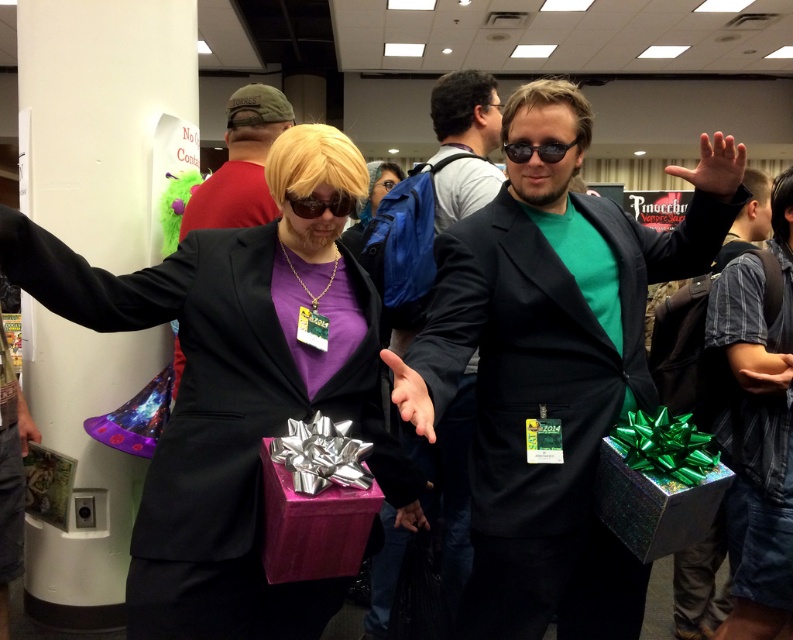
In the scene shown: Is matte purple gift box at center further to camera compared to green matte hand at upper right?

No, it is not.

Does matte purple gift box at center have a greater height compared to green matte hand at upper right?

Yes.

Is point (267, 362) positioned before point (711, 138)?

That is True.

Identify the location of matte purple gift box at center. Image resolution: width=793 pixels, height=640 pixels. (236, 392).

Is green matte hand at upper right thinner than matte black hand at center?

Incorrect, green matte hand at upper right's width is not less than matte black hand at center's.

Does point (700, 150) come farther from viewer compared to point (396, 358)?

Yes, it is behind point (396, 358).

Find the location of a particular element. green matte hand at upper right is located at coordinates (714, 164).

From the picture: Does shiny black suit at center have a smaller size compared to green matte hand at upper right?

Actually, shiny black suit at center might be larger than green matte hand at upper right.

Is shiny black suit at center above green matte hand at upper right?

No.

Which is behind, point (374, 618) or point (669, 173)?

The point (374, 618) is more distant.

The image size is (793, 640). Find the location of `shiny black suit at center`. shiny black suit at center is located at coordinates (464, 144).